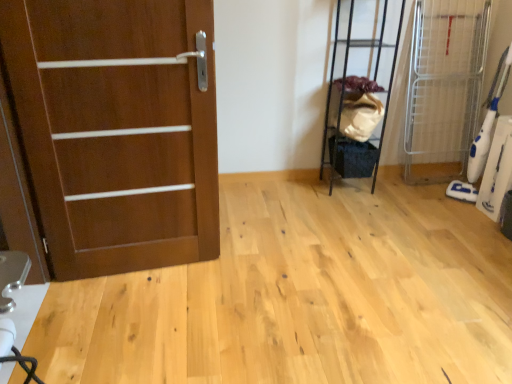
Identify the location of matte wood door at left. (117, 129).

Where is `black metal shelf at upper right, which ranks as the second elevator in right-to-left order`? The height and width of the screenshot is (384, 512). black metal shelf at upper right, which ranks as the second elevator in right-to-left order is located at coordinates (360, 86).

Considering the points (143, 155) and (371, 14), which point is behind, point (143, 155) or point (371, 14)?

The point (371, 14) is farther from the camera.

Is matte wood door at left turned away from black metal shelf at upper right, arranged as the 1th elevator when viewed from the left?

No, matte wood door at left is not facing the opposite direction of black metal shelf at upper right, arranged as the 1th elevator when viewed from the left.

Who is more distant, matte wood door at left or black metal shelf at upper right, arranged as the 1th elevator when viewed from the left?

Positioned behind is black metal shelf at upper right, arranged as the 1th elevator when viewed from the left.

Can you confirm if matte wood door at left is wider than white plastic vacuum cleaner at right, which is counted as the first elevator, starting from the right?

No.

Considering the sizes of objects matte wood door at left and white plastic vacuum cleaner at right, which is counted as the first elevator, starting from the right, in the image provided, who is taller, matte wood door at left or white plastic vacuum cleaner at right, which is counted as the first elevator, starting from the right,?

With more height is matte wood door at left.

Is matte wood door at left behind white plastic vacuum cleaner at right, which ranks as the 2th elevator in left-to-right order?

No, the depth of matte wood door at left is less than that of white plastic vacuum cleaner at right, which ranks as the 2th elevator in left-to-right order.

Can you confirm if black metal shelf at upper right, arranged as the 1th elevator when viewed from the left, is wider than white plastic vacuum cleaner at right, which ranks as the 2th elevator in left-to-right order?

Incorrect, the width of black metal shelf at upper right, arranged as the 1th elevator when viewed from the left, does not surpass that of white plastic vacuum cleaner at right, which ranks as the 2th elevator in left-to-right order.

At what (x,y) coordinates should I click in order to perform the action: click on elevator that is below the black metal shelf at upper right, which ranks as the second elevator in right-to-left order (from the image's perspective). Please return your answer as a coordinate pair (x, y). The height and width of the screenshot is (384, 512). Looking at the image, I should click on (444, 87).

Consider the image. Which is correct: black metal shelf at upper right, which ranks as the second elevator in right-to-left order, is inside white plastic vacuum cleaner at right, which ranks as the 2th elevator in left-to-right order, or outside of it?

The correct answer is: outside.

Considering the sizes of objects white plastic vacuum cleaner at right, which ranks as the 2th elevator in left-to-right order, and matte wood door at left in the image provided, who is wider, white plastic vacuum cleaner at right, which ranks as the 2th elevator in left-to-right order, or matte wood door at left?

white plastic vacuum cleaner at right, which ranks as the 2th elevator in left-to-right order.

From a real-world perspective, is white plastic vacuum cleaner at right, which is counted as the first elevator, starting from the right, located beneath matte wood door at left?

Indeed, from a real-world perspective, white plastic vacuum cleaner at right, which is counted as the first elevator, starting from the right, is positioned beneath matte wood door at left.

How different are the orientations of white plastic vacuum cleaner at right, which ranks as the 2th elevator in left-to-right order, and matte wood door at left in degrees?

There is a 96.8-degree angle between the facing directions of white plastic vacuum cleaner at right, which ranks as the 2th elevator in left-to-right order, and matte wood door at left.

Is white plastic vacuum cleaner at right, which is counted as the first elevator, starting from the right, oriented towards matte wood door at left?

No, white plastic vacuum cleaner at right, which is counted as the first elevator, starting from the right, is not aimed at matte wood door at left.

Is white plastic vacuum cleaner at right, which ranks as the 2th elevator in left-to-right order, situated inside black metal shelf at upper right, which ranks as the second elevator in right-to-left order, or outside?

white plastic vacuum cleaner at right, which ranks as the 2th elevator in left-to-right order, lies outside black metal shelf at upper right, which ranks as the second elevator in right-to-left order.

Can you tell me how much white plastic vacuum cleaner at right, which ranks as the 2th elevator in left-to-right order, and black metal shelf at upper right, which ranks as the second elevator in right-to-left order, differ in facing direction?

90.8 degrees.

From a real-world perspective, who is located lower, white plastic vacuum cleaner at right, which is counted as the first elevator, starting from the right, or black metal shelf at upper right, arranged as the 1th elevator when viewed from the left?

white plastic vacuum cleaner at right, which is counted as the first elevator, starting from the right.

I want to click on elevator on the left of white plastic vacuum cleaner at right, which is counted as the first elevator, starting from the right, so click(360, 86).

From the image's perspective, does black metal shelf at upper right, which ranks as the second elevator in right-to-left order, appear lower than matte wood door at left?

Actually, black metal shelf at upper right, which ranks as the second elevator in right-to-left order, appears above matte wood door at left in the image.

Would you say black metal shelf at upper right, arranged as the 1th elevator when viewed from the left, is to the left or to the right of matte wood door at left in the picture?

black metal shelf at upper right, arranged as the 1th elevator when viewed from the left, is to the right of matte wood door at left.

Could you tell me if black metal shelf at upper right, arranged as the 1th elevator when viewed from the left, is turned towards matte wood door at left?

No, black metal shelf at upper right, arranged as the 1th elevator when viewed from the left, is not turned towards matte wood door at left.

Looking at this image, does black metal shelf at upper right, arranged as the 1th elevator when viewed from the left, have a greater height compared to matte wood door at left?

Incorrect, the height of black metal shelf at upper right, arranged as the 1th elevator when viewed from the left, is not larger of that of matte wood door at left.

This screenshot has width=512, height=384. Find the location of `door below the black metal shelf at upper right, which ranks as the second elevator in right-to-left order (from the image's perspective)`. door below the black metal shelf at upper right, which ranks as the second elevator in right-to-left order (from the image's perspective) is located at coordinates pyautogui.click(x=117, y=129).

Identify the location of door in front of the white plastic vacuum cleaner at right, which is counted as the first elevator, starting from the right. The image size is (512, 384). (117, 129).

Estimate the real-world distances between objects in this image. Which object is closer to black metal shelf at upper right, arranged as the 1th elevator when viewed from the left, white plastic vacuum cleaner at right, which is counted as the first elevator, starting from the right, or matte wood door at left?

Among the two, white plastic vacuum cleaner at right, which is counted as the first elevator, starting from the right, is located nearer to black metal shelf at upper right, arranged as the 1th elevator when viewed from the left.

Estimate the real-world distances between objects in this image. Which object is further from white plastic vacuum cleaner at right, which ranks as the 2th elevator in left-to-right order, black metal shelf at upper right, arranged as the 1th elevator when viewed from the left, or matte wood door at left?

matte wood door at left lies further to white plastic vacuum cleaner at right, which ranks as the 2th elevator in left-to-right order, than the other object.

Considering their positions, is matte wood door at left positioned closer to white plastic vacuum cleaner at right, which is counted as the first elevator, starting from the right, than black metal shelf at upper right, which ranks as the second elevator in right-to-left order?

Based on the image, black metal shelf at upper right, which ranks as the second elevator in right-to-left order, appears to be nearer to white plastic vacuum cleaner at right, which is counted as the first elevator, starting from the right.

Estimate the real-world distances between objects in this image. Which object is further from matte wood door at left, white plastic vacuum cleaner at right, which ranks as the 2th elevator in left-to-right order, or black metal shelf at upper right, arranged as the 1th elevator when viewed from the left?

white plastic vacuum cleaner at right, which ranks as the 2th elevator in left-to-right order, lies further to matte wood door at left than the other object.

Based on the photo, estimate the real-world distances between objects in this image. Which object is closer to matte wood door at left, black metal shelf at upper right, which ranks as the second elevator in right-to-left order, or white plastic vacuum cleaner at right, which is counted as the first elevator, starting from the right?

black metal shelf at upper right, which ranks as the second elevator in right-to-left order, is closer to matte wood door at left.

Considering their positions, is matte wood door at left positioned closer to black metal shelf at upper right, arranged as the 1th elevator when viewed from the left, than white plastic vacuum cleaner at right, which is counted as the first elevator, starting from the right?

Among the two, white plastic vacuum cleaner at right, which is counted as the first elevator, starting from the right, is located nearer to black metal shelf at upper right, arranged as the 1th elevator when viewed from the left.

At what (x,y) coordinates should I click in order to perform the action: click on elevator between matte wood door at left and white plastic vacuum cleaner at right, which ranks as the 2th elevator in left-to-right order, from left to right. Please return your answer as a coordinate pair (x, y). This screenshot has height=384, width=512. Looking at the image, I should click on (360, 86).